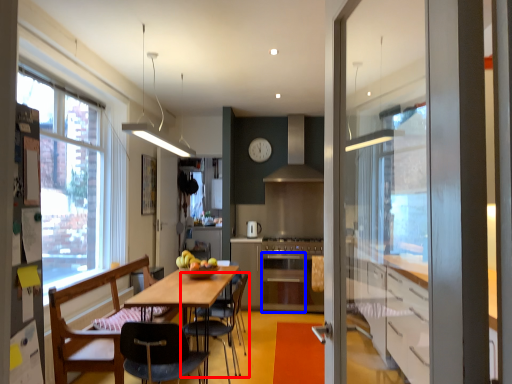
Question: Which point is closer to the camera, chair (highlighted by a red box) or oven (highlighted by a blue box)?

Choices:
 (A) chair
 (B) oven

Answer: (A)